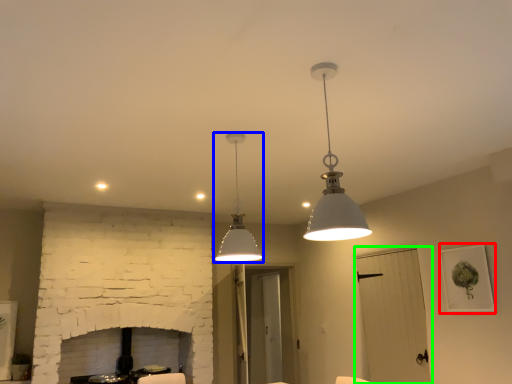
Question: Which is nearer to the picture frame (highlighted by a red box)? lamp (highlighted by a blue box) or glass door (highlighted by a green box).

Choices:
 (A) lamp
 (B) glass door

Answer: (B)